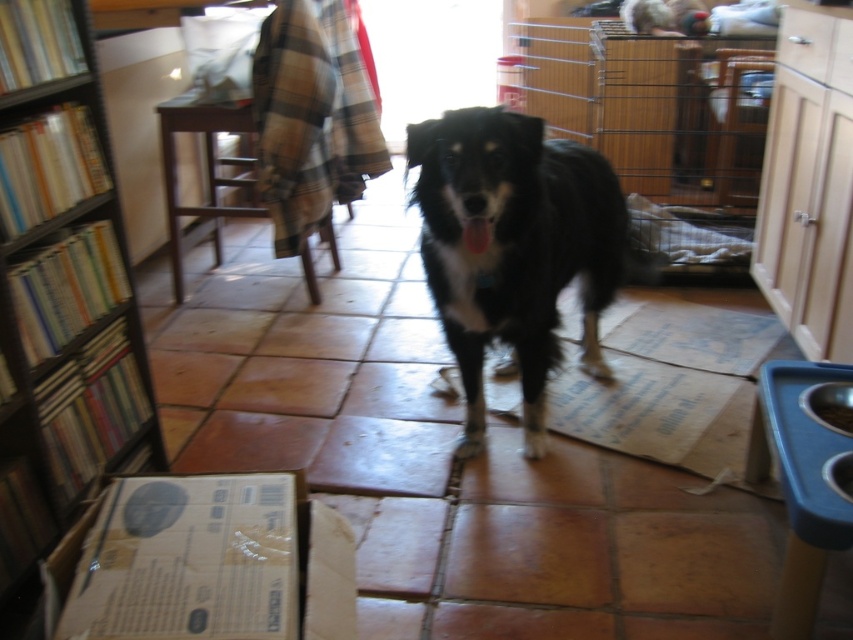
You are trying to decide whether to place a new floor lamp in the room. The lamp is 1.8 meters tall. Given the height of the brown wooden bookcase at left and the black fur dog at center, do you think the lamp will fit in terms of height without being too tall compared to the existing furniture?

The brown wooden bookcase at left is much taller than the black fur dog at center. Since the bookcase is already much taller, the 1.8 meter tall lamp would likely be an appropriate height and not too tall compared to the existing furniture in the room.